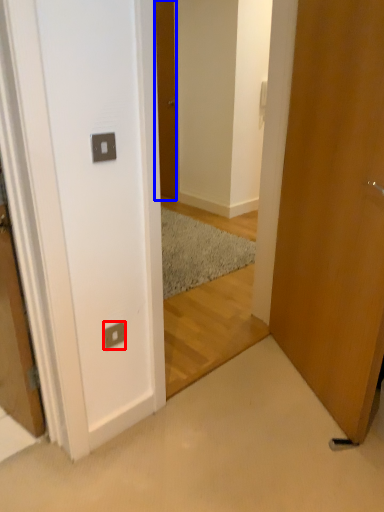
Question: Which object appears closest to the camera in this image, electric outlet (highlighted by a red box) or door (highlighted by a blue box)?

Choices:
 (A) electric outlet
 (B) door

Answer: (A)